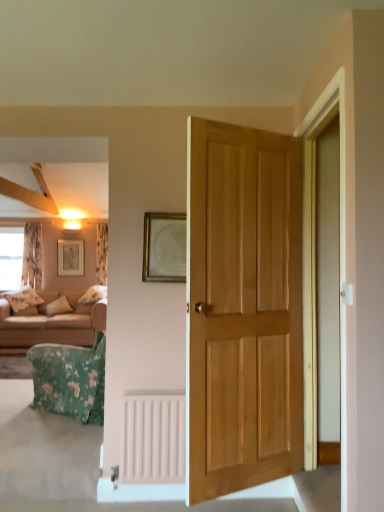
Question: From the image's perspective, is light brown wooden door at center above or below floral fabric curtain at left, the second curtain when ordered from left to right?

Choices:
 (A) below
 (B) above

Answer: (A)

Question: Is light brown wooden door at center in front of or behind floral fabric curtain at left, the second curtain when ordered from left to right, in the image?

Choices:
 (A) behind
 (B) front

Answer: (B)

Question: Which is nearer to the floral fabric curtain at left, placed as the first curtain when sorted from left to right?

Choices:
 (A) floral fabric curtain at left, the second curtain when ordered from left to right
 (B) matte gold picture frame at upper left, which ranks as the 1th picture frame in back-to-front order
 (C) light brown wooden door at center
 (D) clear glass window at left
 (E) gold metallic picture frame at center, the 2th picture frame when ordered from left to right

Answer: (D)

Question: Estimate the real-world distances between objects in this image. Which object is farther from the beige fabric couch at left?

Choices:
 (A) floral fabric curtain at left, which is the 2th curtain from right to left
 (B) floral fabric curtain at left, the second curtain when ordered from left to right
 (C) matte gold picture frame at upper left, the second picture frame from the front
 (D) clear glass window at left
 (E) light brown wooden door at center

Answer: (E)